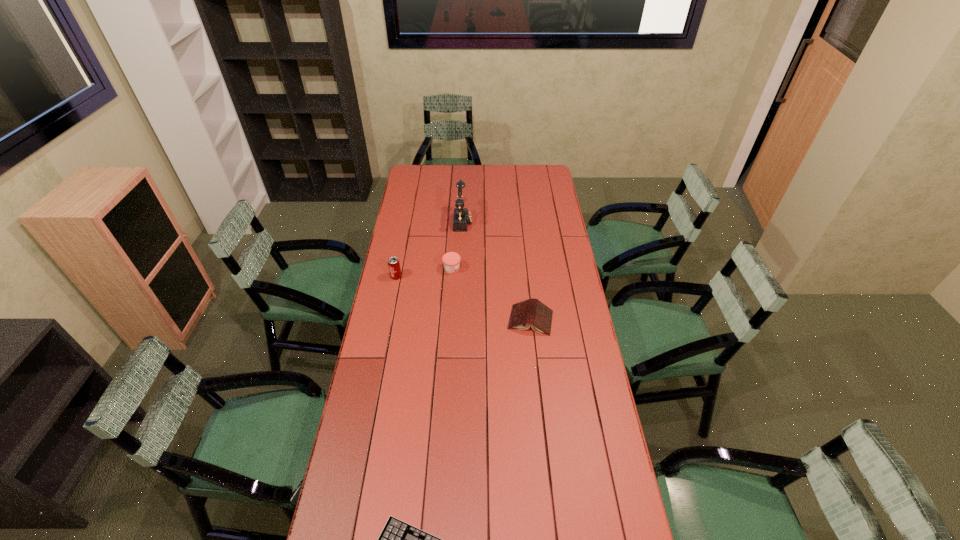
The width and height of the screenshot is (960, 540). Find the location of `free space located on the front of the fourth farthest object`. free space located on the front of the fourth farthest object is located at coordinates (540, 403).

Image resolution: width=960 pixels, height=540 pixels. In order to click on object that is positioned at the left edge in this screenshot , I will do `click(393, 262)`.

Find the location of `object present at the right edge`. object present at the right edge is located at coordinates (533, 312).

In order to click on free space at the far edge in this screenshot , I will do (493, 169).

Where is `vacant region at the left edge of the desktop`? The width and height of the screenshot is (960, 540). vacant region at the left edge of the desktop is located at coordinates (401, 288).

In the image, there is a desktop. Where is `vacant space at the right edge`? The image size is (960, 540). vacant space at the right edge is located at coordinates (541, 236).

At what (x,y) coordinates should I click in order to perform the action: click on vacant space at the far left corner of the desktop. Please return your answer as a coordinate pair (x, y). This screenshot has width=960, height=540. Looking at the image, I should click on (421, 169).

Find the location of a particular element. This screenshot has width=960, height=540. vacant space at the far right corner of the desktop is located at coordinates (546, 165).

Image resolution: width=960 pixels, height=540 pixels. Identify the location of vacant space that is in between the jam and the second nearest object. (492, 294).

This screenshot has width=960, height=540. In order to click on unoccupied position between the jam and the fourth tallest object in this screenshot , I will do `click(492, 294)`.